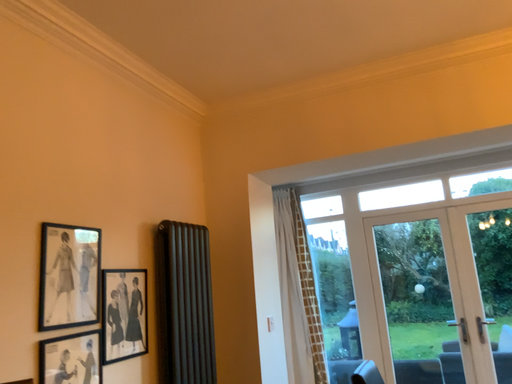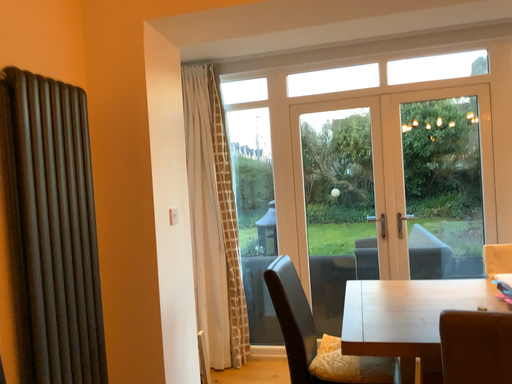
Question: How did the camera likely rotate when shooting the video?

Choices:
 (A) rotated upward
 (B) rotated downward

Answer: (B)